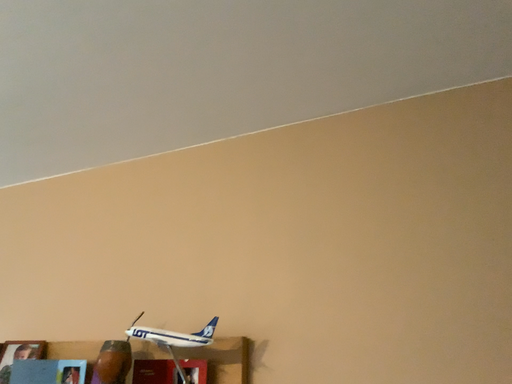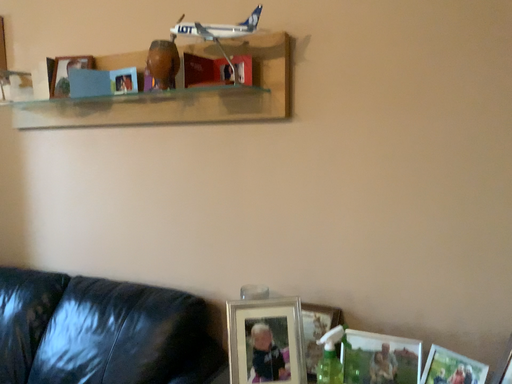
Question: How did the camera likely rotate when shooting the video?

Choices:
 (A) rotated upward
 (B) rotated downward

Answer: (B)